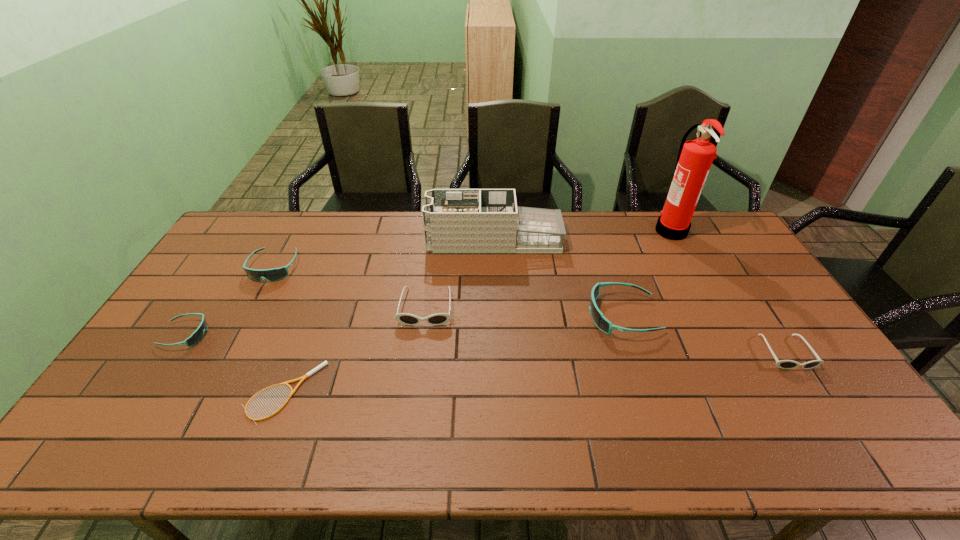
You are a GUI agent. You are given a task and a screenshot of the screen. Output one action in this format:
    pyautogui.click(x=<x>, y=<y>)
    Task: Click on the leftmost sunglasses
    This screenshot has height=540, width=960.
    Given the screenshot: What is the action you would take?
    pyautogui.click(x=197, y=336)

What are the coordinates of `the smaller black sunglasses` in the screenshot? It's located at (783, 364).

I want to click on the rightmost object, so click(x=783, y=364).

The image size is (960, 540). I want to click on beige tennis racket, so click(325, 362).

Image resolution: width=960 pixels, height=540 pixels. Identify the location of tennis racket. (325, 362).

At what (x,y) coordinates should I click in order to perform the action: click on vacant space located 0.060m with the nozzle aimed from the seventh object from left to right. Please return your answer as a coordinate pair (x, y). This screenshot has width=960, height=540. Looking at the image, I should click on (639, 230).

Locate an element on the screen. This screenshot has width=960, height=540. free location located with the nozzle aimed from the seventh object from left to right is located at coordinates (615, 230).

Image resolution: width=960 pixels, height=540 pixels. Identify the location of vacant space positioned with the nozzle aimed from the seventh object from left to right. (591, 230).

I want to click on vacant area situated 0.350m at the entrance of the dollhouse, so click(x=331, y=240).

Identify the location of free space located 0.120m at the entrance of the dollhouse. The image size is (960, 540). (395, 240).